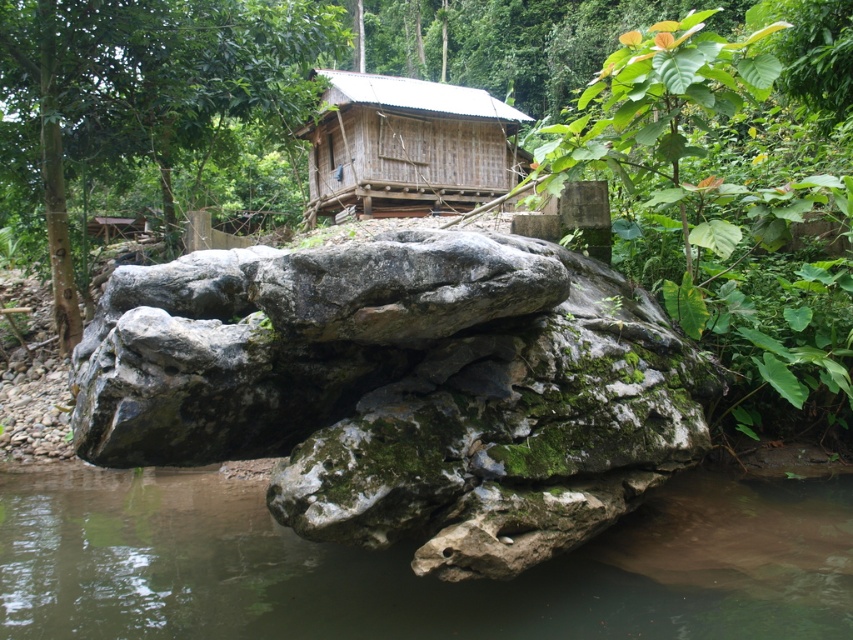
Question: Which is farther from the mossy stone rock at center?

Choices:
 (A) wooden cabin at center
 (B) green mossy rock at lower center

Answer: (A)

Question: Can you confirm if green mossy rock at lower center is thinner than wooden cabin at center?

Choices:
 (A) yes
 (B) no

Answer: (B)

Question: Is green mossy rock at lower center to the left of wooden cabin at center from the viewer's perspective?

Choices:
 (A) yes
 (B) no

Answer: (A)

Question: Which object is positioned closest to the wooden cabin at center?

Choices:
 (A) mossy stone rock at center
 (B) green mossy rock at lower center

Answer: (B)

Question: Does mossy stone rock at center appear under green mossy rock at lower center?

Choices:
 (A) no
 (B) yes

Answer: (A)

Question: Estimate the real-world distances between objects in this image. Which object is closer to the green mossy rock at lower center?

Choices:
 (A) wooden cabin at center
 (B) mossy stone rock at center

Answer: (B)